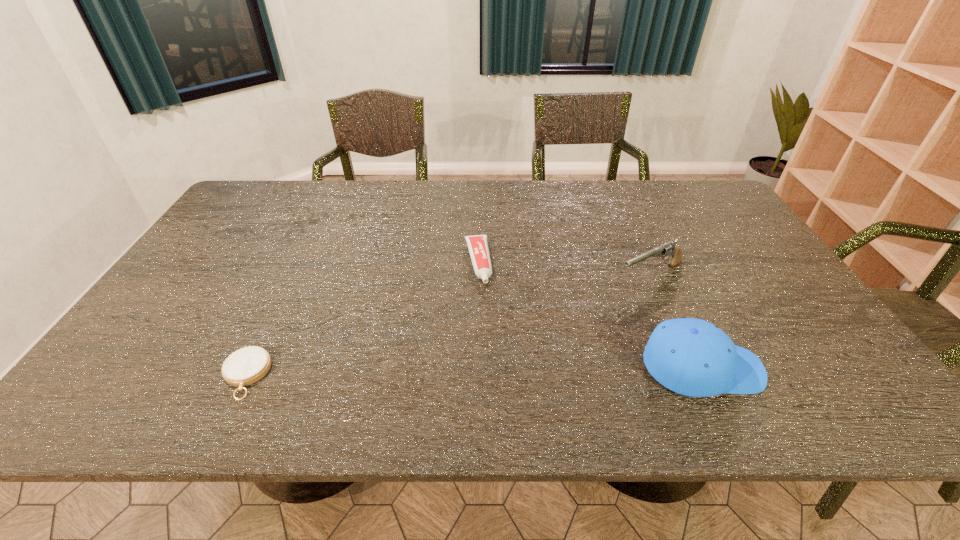
Identify the location of free space on the desktop that is between the shortest object and the tallest object and is positioned aiming along the barrel of the third shortest object. (456, 372).

Locate an element on the screen. free spot on the desktop that is between the shortest object and the tallest object and is positioned at the nozzle of the third tallest object is located at coordinates (501, 371).